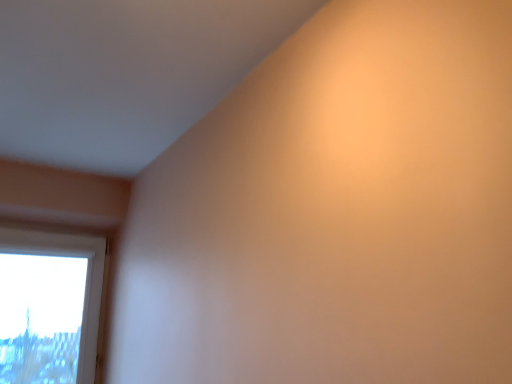
I want to click on white plastic window at lower left, so click(49, 306).

The height and width of the screenshot is (384, 512). Describe the element at coordinates (49, 306) in the screenshot. I see `white plastic window at lower left` at that location.

Find the location of a particular element. The height and width of the screenshot is (384, 512). white plastic window at lower left is located at coordinates (49, 306).